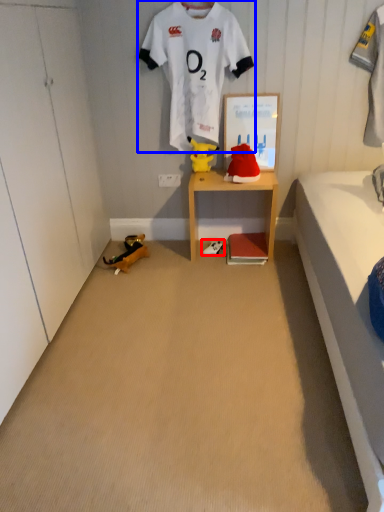
Question: Which point is closer to the camera, footwear (highlighted by a red box) or sports uniform (highlighted by a blue box)?

Choices:
 (A) footwear
 (B) sports uniform

Answer: (B)